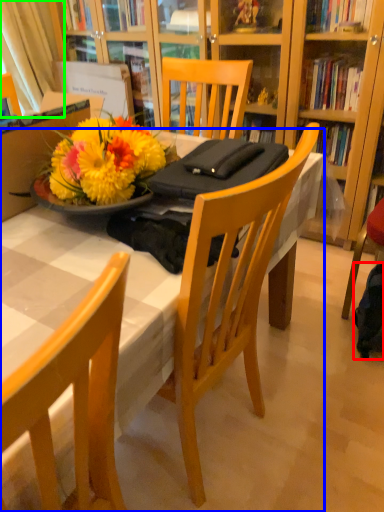
Question: Which object is positioned closest to backpack (highlighted by a red box)? Select from desk (highlighted by a blue box) and curtain (highlighted by a green box).

Choices:
 (A) desk
 (B) curtain

Answer: (A)